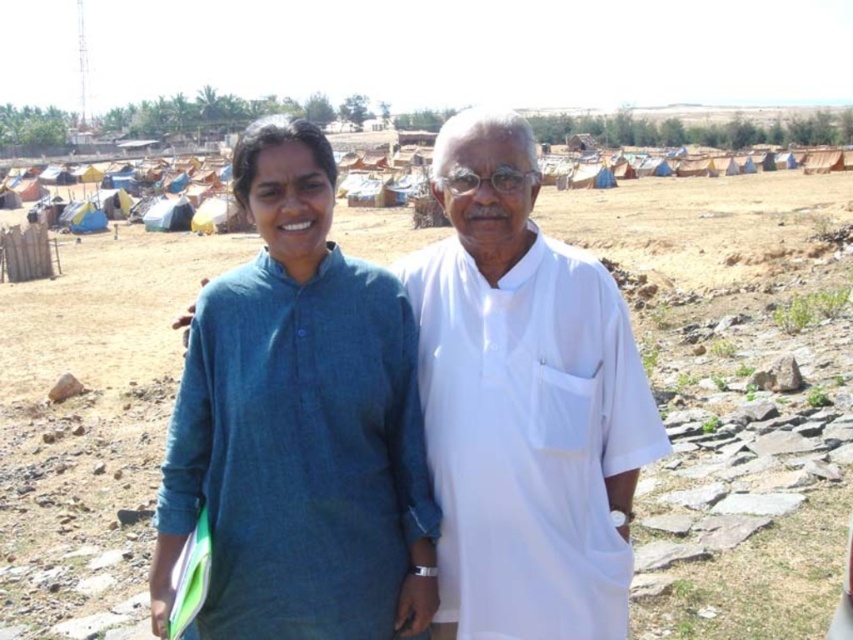
Is brown soil at center to the right of white cotton kurta at center from the viewer's perspective?

Indeed, brown soil at center is positioned on the right side of white cotton kurta at center.

Is point (674, 388) behind point (502, 141)?

Yes, point (674, 388) is farther from viewer.

Where is `brown soil at center`? brown soil at center is located at coordinates (732, 394).

The width and height of the screenshot is (853, 640). Find the location of `brown soil at center`. brown soil at center is located at coordinates (732, 394).

The height and width of the screenshot is (640, 853). What are the coordinates of `denim shirt at center` in the screenshot? It's located at (299, 424).

Does point (190, 460) come behind point (590, 545)?

That is True.

Where is `denim shirt at center`? The width and height of the screenshot is (853, 640). denim shirt at center is located at coordinates 299,424.

In the scene shown: Can you confirm if brown soil at center is wider than denim shirt at center?

Yes.

This screenshot has width=853, height=640. Describe the element at coordinates (732, 394) in the screenshot. I see `brown soil at center` at that location.

Who is more forward, (x=662, y=284) or (x=351, y=337)?

Point (x=351, y=337) is in front.

Find the location of a particular element. The width and height of the screenshot is (853, 640). brown soil at center is located at coordinates (x=732, y=394).